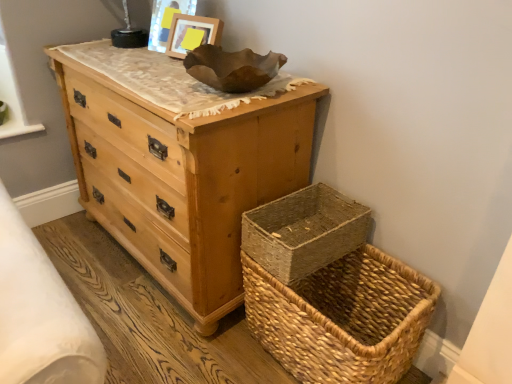
Question: Considering their positions, is wooden frame at upper center located in front of or behind woven natural basket at lower right?

Choices:
 (A) behind
 (B) front

Answer: (A)

Question: Looking at the image, does wooden frame at upper center seem bigger or smaller compared to woven natural basket at lower right?

Choices:
 (A) small
 (B) big

Answer: (A)

Question: Estimate the real-world distances between objects in this image. Which object is closer to the natural wood chest of drawers at upper left?

Choices:
 (A) woven natural basket at lower right
 (B) wooden frame at upper center
 (C) natural woven picnic basket at lower right

Answer: (A)

Question: Based on their relative distances, which object is farther from the natural woven picnic basket at lower right?

Choices:
 (A) woven natural basket at lower right
 (B) wooden frame at upper center
 (C) natural wood chest of drawers at upper left

Answer: (B)